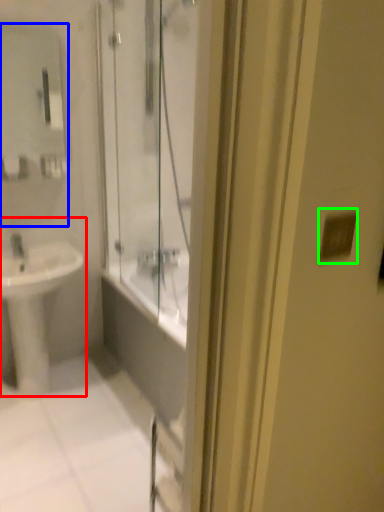
Question: Based on their relative distances, which object is farther from sink (highlighted by a red box)? Choose from mirror (highlighted by a blue box) and light switch (highlighted by a green box).

Choices:
 (A) mirror
 (B) light switch

Answer: (B)